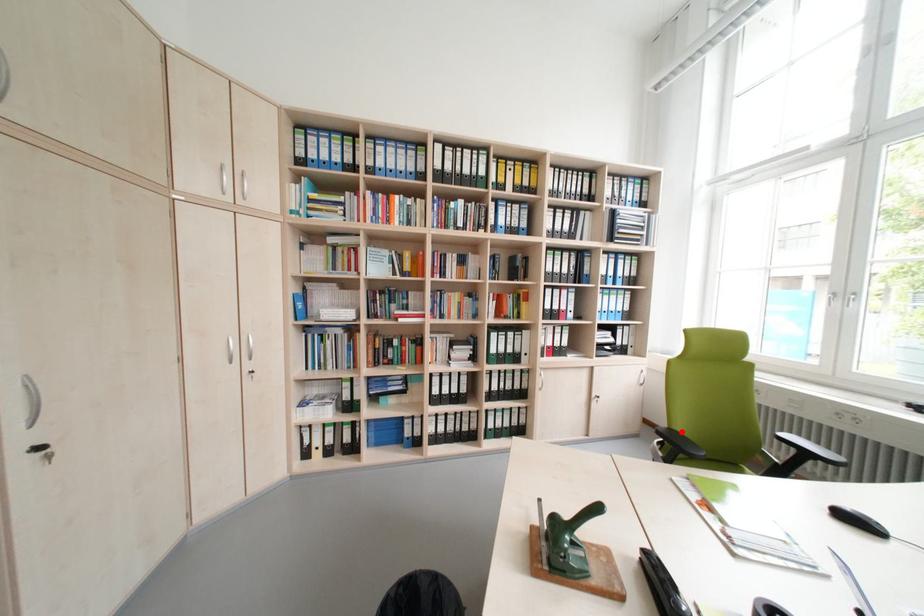
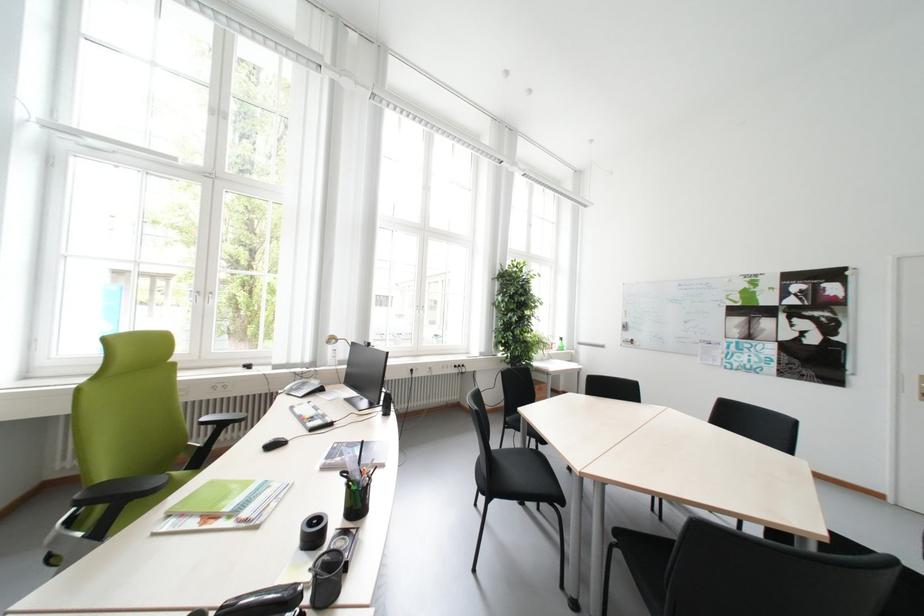
Question: I am providing you with two images of the same scene from different viewpoints. In image1, a red point is highlighted. Considering the same 3D point in image2, which of the following is correct?

Choices:
 (A) It is closer
 (B) It is farther

Answer: (A)